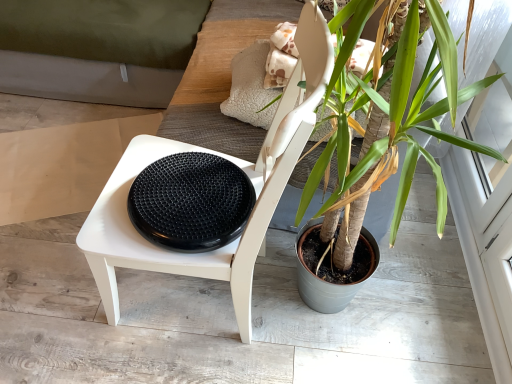
Identify the location of vacant region below white matte chair at center (from a real-world perspective). (195, 296).